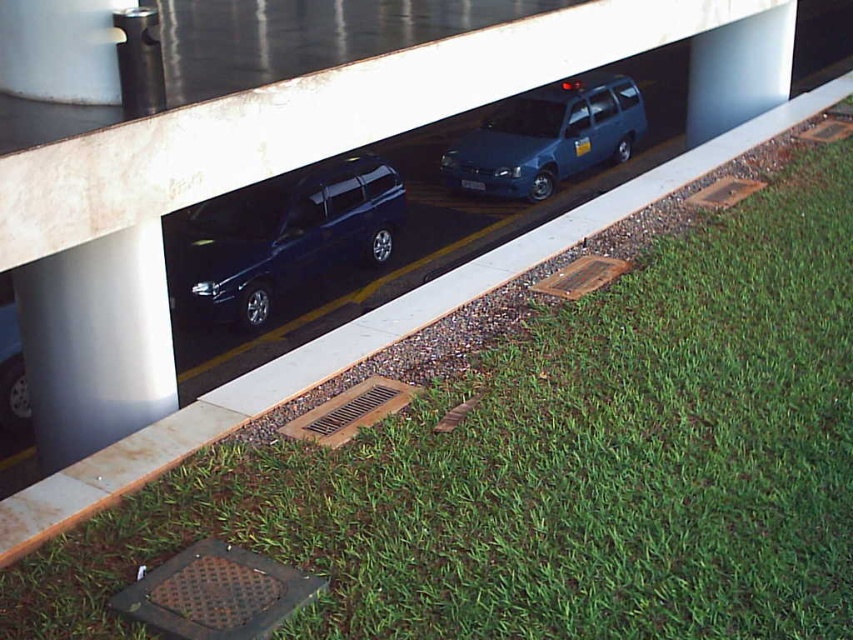
You are standing at the edge of the road and notice the satin silver pillar at center left. Can you determine its exact coordinates in the image?

The satin silver pillar at center left is located at point (96, 342).

You are standing at the point with coordinates (547,138). What object is exactly at your current location?

The metallic blue minivan at center is located at point (547,138), so the object at your current location is the metallic blue minivan at center.